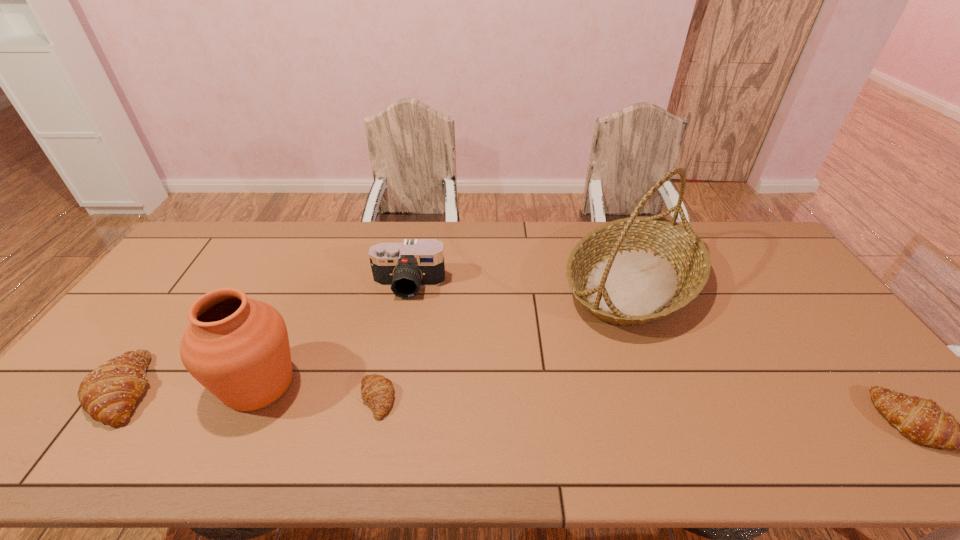
Find the location of a particular element. This screenshot has width=960, height=540. the second closest object relative to the rightmost object is located at coordinates (405, 267).

The width and height of the screenshot is (960, 540). I want to click on object that stands as the closest to the shortest crescent roll, so click(x=238, y=348).

Locate which crescent roll ranks second in proximity to the second object from right to left. Please provide its 2D coordinates. Your answer should be formatted as a tuple, i.e. [(x, y)], where the tuple contains the x and y coordinates of a point satisfying the conditions above.

[(377, 390)]

Image resolution: width=960 pixels, height=540 pixels. Identify the location of the closest crescent roll to the basket. (922, 420).

Find the location of a particular element. The height and width of the screenshot is (540, 960). vacant region that satisfies the following two spatial constraints: 1. on the back side of the second tallest object; 2. on the right side of the leftmost object is located at coordinates (129, 384).

Find the location of a particular element. free location that satisfies the following two spatial constraints: 1. on the front side of the fifth object from right to left; 2. on the right side of the second crescent roll from left to right is located at coordinates (252, 399).

Locate an element on the screen. This screenshot has width=960, height=540. free space in the image that satisfies the following two spatial constraints: 1. on the front side of the leftmost crescent roll; 2. on the left side of the second crescent roll from right to left is located at coordinates (118, 399).